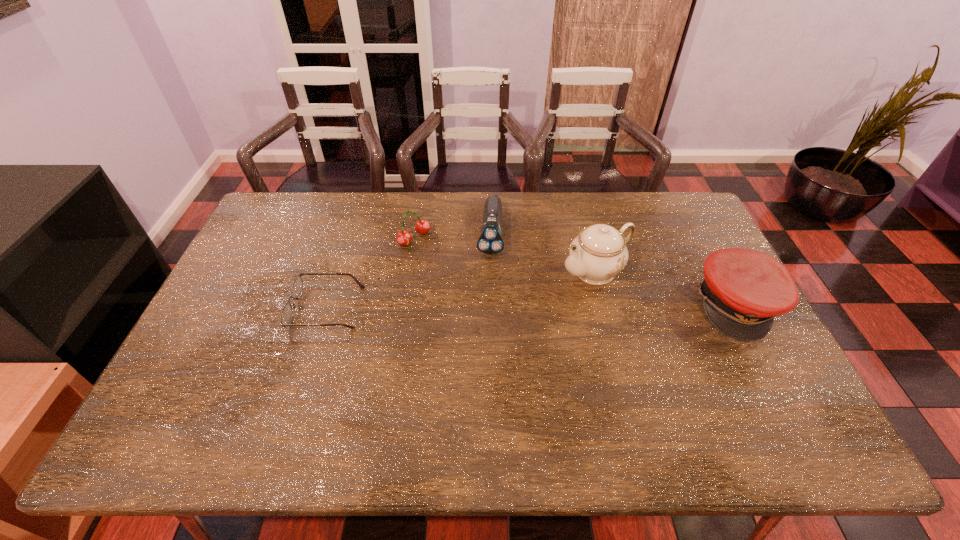
The width and height of the screenshot is (960, 540). I want to click on free spot on the desktop that is between the spectacles and the rightmost object and is positioned with stems pointing upwards on the cherry, so click(x=502, y=306).

Identify the location of vacant space on the desktop that is between the spectacles and the rightmost object and is positioned on the head of the third object from right to left. pos(484,307).

Locate an element on the screen. This screenshot has width=960, height=540. vacant space on the desktop that is between the shortest object and the cap and is positioned at the spout of the chinaware is located at coordinates [x=526, y=306].